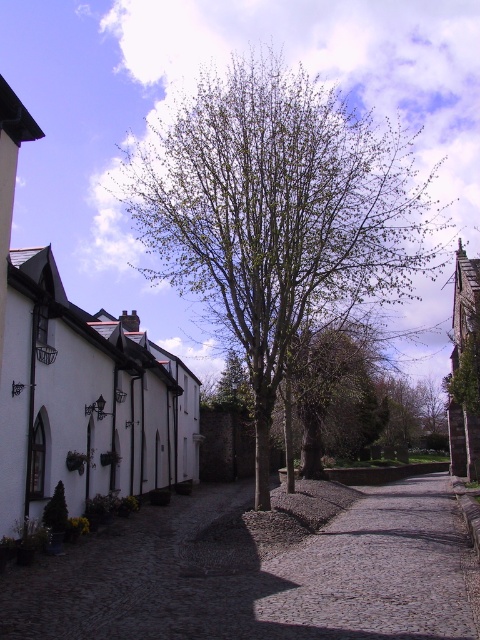
You are standing on the cobblestone street and want to take a photo of both the point at coordinates (235,140) and the point at coordinates (350,612). Which point is closer to your camera lens?

Point (235,140) is further to the camera than point (350,612), so the point at coordinates (350,612) is closer to your camera lens.